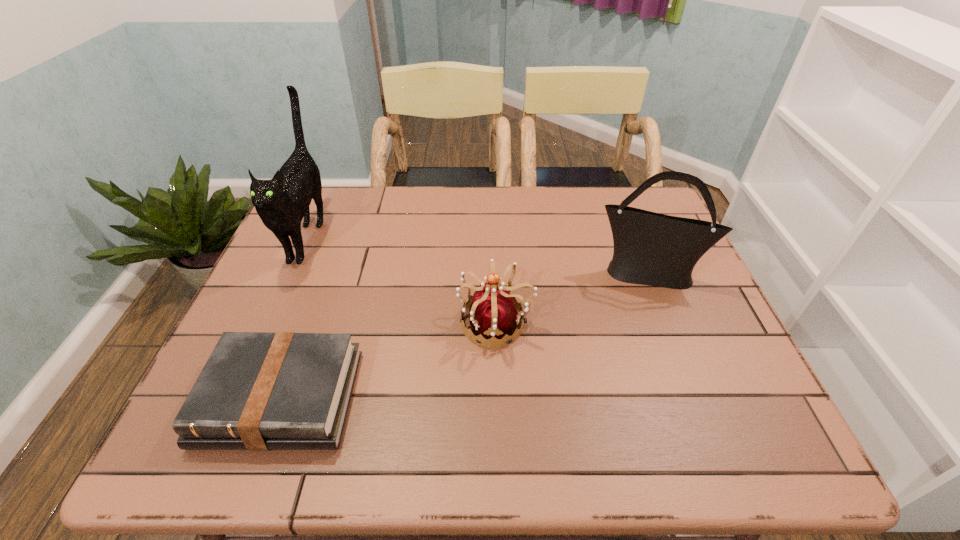
Where is `cat`? This screenshot has height=540, width=960. cat is located at coordinates (282, 202).

Locate an element on the screen. shoulder bag is located at coordinates (653, 249).

Locate an element on the screen. the second tallest object is located at coordinates pyautogui.click(x=653, y=249).

Locate an element on the screen. This screenshot has height=540, width=960. tiara is located at coordinates (493, 313).

Locate an element on the screen. the second object from right to left is located at coordinates (493, 313).

I want to click on hardback book, so click(x=259, y=391).

The width and height of the screenshot is (960, 540). I want to click on vacant space located on the face of the cat, so click(x=274, y=315).

Locate an element on the screen. The image size is (960, 540). vacant region located on the back of the shoulder bag is located at coordinates click(x=617, y=202).

Locate an element on the screen. free point located 0.400m on the front-facing side of the third object from left to right is located at coordinates (290, 323).

I want to click on free space located 0.180m on the front-facing side of the third object from left to right, so click(x=382, y=323).